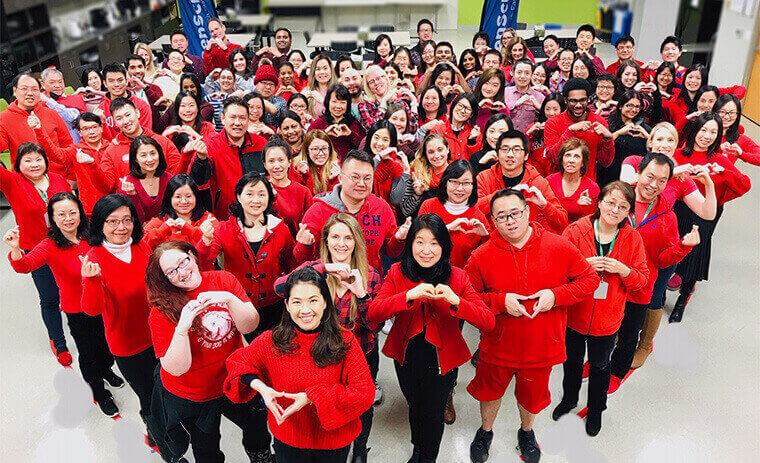
Find the location of `empty floor spaces`. empty floor spaces is located at coordinates (711, 399), (32, 418).